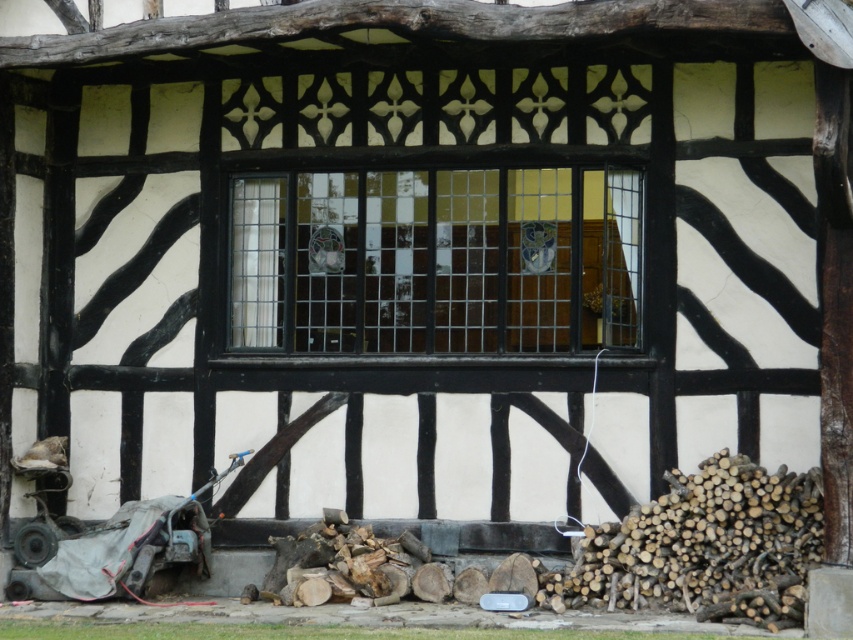
Question: Can you confirm if clear glass window at center is wider than gray fabric-covered baby carriage at lower left?

Choices:
 (A) yes
 (B) no

Answer: (A)

Question: Can you confirm if clear glass window at center is wider than gray fabric-covered baby carriage at lower left?

Choices:
 (A) no
 (B) yes

Answer: (B)

Question: Where is clear glass window at center located in relation to gray fabric-covered baby carriage at lower left in the image?

Choices:
 (A) right
 (B) left

Answer: (A)